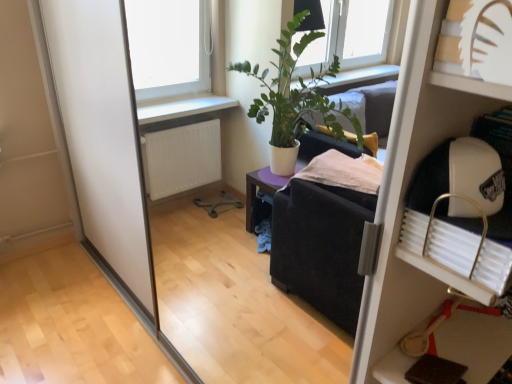
Question: Is white plastic shelf at upper right, placed as the second shelf when sorted from top to bottom, wider than white paper cutout at upper right, the 1th shelf viewed from the front?

Choices:
 (A) yes
 (B) no

Answer: (A)

Question: Does white plastic shelf at upper right, acting as the first shelf starting from the right, lie behind white paper cutout at upper right, the 2th shelf in the back-to-front sequence?

Choices:
 (A) no
 (B) yes

Answer: (B)

Question: Could you tell me if white plastic shelf at upper right, the second shelf in the left-to-right sequence, is turned towards white paper cutout at upper right, which is the 1th shelf from top to bottom?

Choices:
 (A) yes
 (B) no

Answer: (B)

Question: From the image's perspective, would you say white plastic shelf at upper right, the first shelf from the bottom, is shown under white paper cutout at upper right, which is the 1th shelf from top to bottom?

Choices:
 (A) no
 (B) yes

Answer: (B)

Question: Would you say white paper cutout at upper right, the 1th shelf viewed from the front, is part of white plastic shelf at upper right, which ranks as the 1th shelf in back-to-front order,'s contents?

Choices:
 (A) no
 (B) yes

Answer: (B)

Question: Is white plastic shelf at upper right, which ranks as the 1th shelf in back-to-front order, beside white paper cutout at upper right, the 2th shelf in the back-to-front sequence?

Choices:
 (A) no
 (B) yes

Answer: (A)

Question: Considering the relative sizes of white paper cutout at upper right, the 1th shelf viewed from the front, and white plastic shelf at upper right, acting as the first shelf starting from the right, in the image provided, is white paper cutout at upper right, the 1th shelf viewed from the front, taller than white plastic shelf at upper right, acting as the first shelf starting from the right,?

Choices:
 (A) yes
 (B) no

Answer: (B)

Question: Considering the relative positions of white paper cutout at upper right, the 2th shelf when ordered from right to left, and white plastic shelf at upper right, the second shelf in the left-to-right sequence, in the image provided, is white paper cutout at upper right, the 2th shelf when ordered from right to left, to the right of white plastic shelf at upper right, the second shelf in the left-to-right sequence, from the viewer's perspective?

Choices:
 (A) yes
 (B) no

Answer: (B)

Question: Can you confirm if white paper cutout at upper right, the 2th shelf when ordered from right to left, is positioned to the left of white plastic shelf at upper right, the second shelf in the left-to-right sequence?

Choices:
 (A) yes
 (B) no

Answer: (A)

Question: Considering the relative sizes of white paper cutout at upper right, the 2th shelf positioned from the bottom, and white plastic shelf at upper right, which ranks as the 1th shelf in back-to-front order, in the image provided, is white paper cutout at upper right, the 2th shelf positioned from the bottom, bigger than white plastic shelf at upper right, which ranks as the 1th shelf in back-to-front order,?

Choices:
 (A) no
 (B) yes

Answer: (A)

Question: Can you confirm if white paper cutout at upper right, the 1th shelf viewed from the front, is wider than white plastic shelf at upper right, the first shelf from the bottom?

Choices:
 (A) no
 (B) yes

Answer: (A)

Question: Is white paper cutout at upper right, which is the 1th shelf from top to bottom, touching white plastic shelf at upper right, which ranks as the 1th shelf in back-to-front order?

Choices:
 (A) yes
 (B) no

Answer: (B)

Question: Visually, is white plastic shelf at upper right, which ranks as the 1th shelf in back-to-front order, positioned to the left or to the right of white paper cutout at upper right, which is the 1th shelf from top to bottom?

Choices:
 (A) right
 (B) left

Answer: (A)